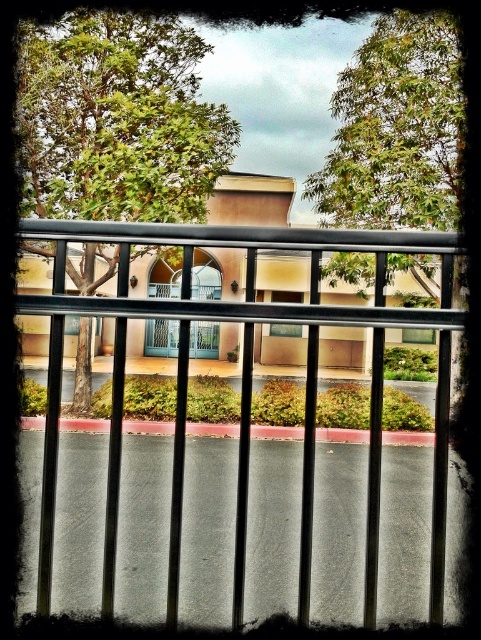
Question: Can you confirm if green leafy tree at center is positioned below green leafy tree at upper center?

Choices:
 (A) yes
 (B) no

Answer: (B)

Question: Considering the relative positions of green leafy tree at center and green leafy tree at upper center in the image provided, where is green leafy tree at center located with respect to green leafy tree at upper center?

Choices:
 (A) right
 (B) left

Answer: (B)

Question: Can you confirm if green leafy tree at center is bigger than green leafy tree at upper center?

Choices:
 (A) no
 (B) yes

Answer: (B)

Question: Considering the real-world distances, which object is farthest from the black metal fence at center?

Choices:
 (A) green leafy tree at center
 (B) green leafy tree at upper center

Answer: (A)

Question: Which of the following is the closest to the observer?

Choices:
 (A) green leafy tree at center
 (B) green leafy tree at upper center

Answer: (B)

Question: Estimate the real-world distances between objects in this image. Which object is farther from the green leafy tree at upper center?

Choices:
 (A) green leafy tree at center
 (B) black metal fence at center

Answer: (B)